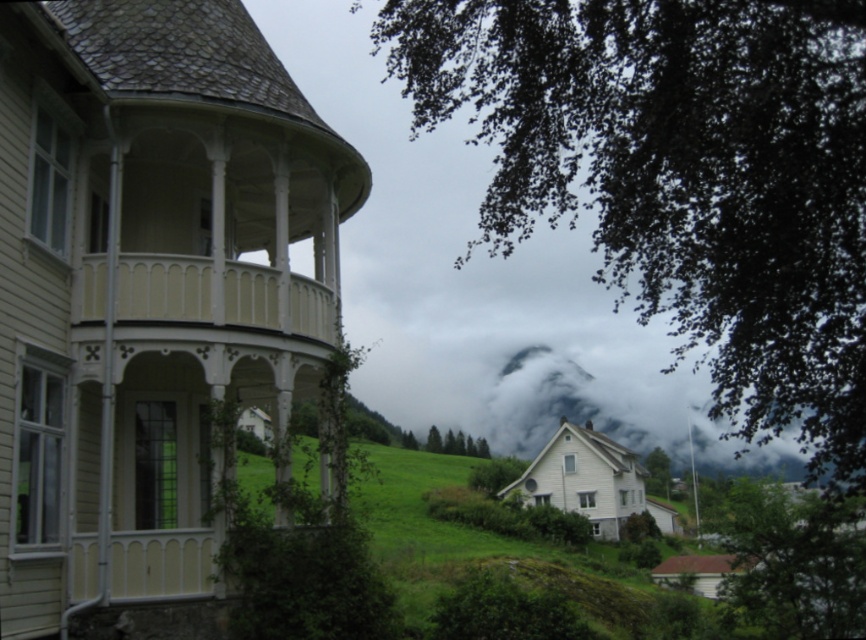
You are standing in the middle of the image and want to walk towards the green leafy tree at lower right. Which direction should you face to avoid the green leafy tree at upper left blocking your view?

You should face to the right to avoid the green leafy tree at upper left blocking your view since the green leafy tree at upper left is to the left of the green leafy tree at lower right.

You are planning to host a small gathering and need to decide whether the matte white gazebo at center can accommodate a 6ft round table. Given the green leafy tree at center is about 4ft wide, can the gazebo fit the table?

The matte white gazebo at center is wider than the green leafy tree at center, which is 4ft wide. Since the gazebo is wider, it should have enough space to fit a 6ft round table.

You are standing in the middle of the rural landscape and want to find the tallest tree between the green leafy tree at lower right and the green leafy tree at center. Which one should you look towards?

The green leafy tree at lower right is taller than the green leafy tree at center, so you should look towards the green leafy tree at lower right.